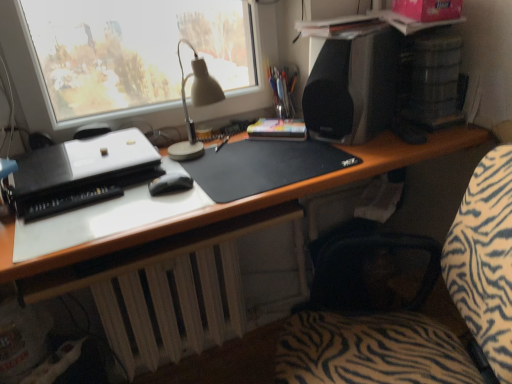
The height and width of the screenshot is (384, 512). I want to click on free space above hardcover book at center (from a real-world perspective), so click(279, 120).